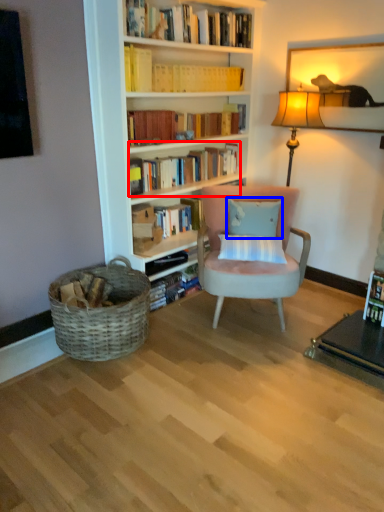
Question: Which point is closer to the camera, book (highlighted by a red box) or pillow (highlighted by a blue box)?

Choices:
 (A) book
 (B) pillow

Answer: (B)